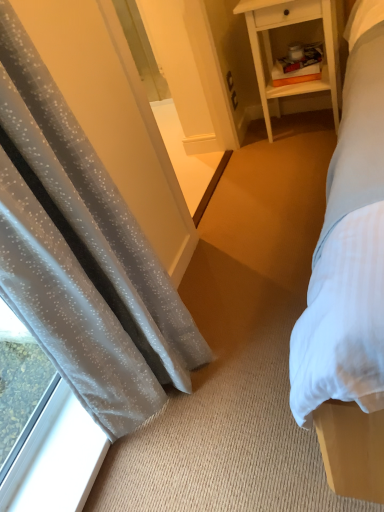
In order to click on free point in front of white wood nightstand at upper right in this screenshot , I will do `click(302, 161)`.